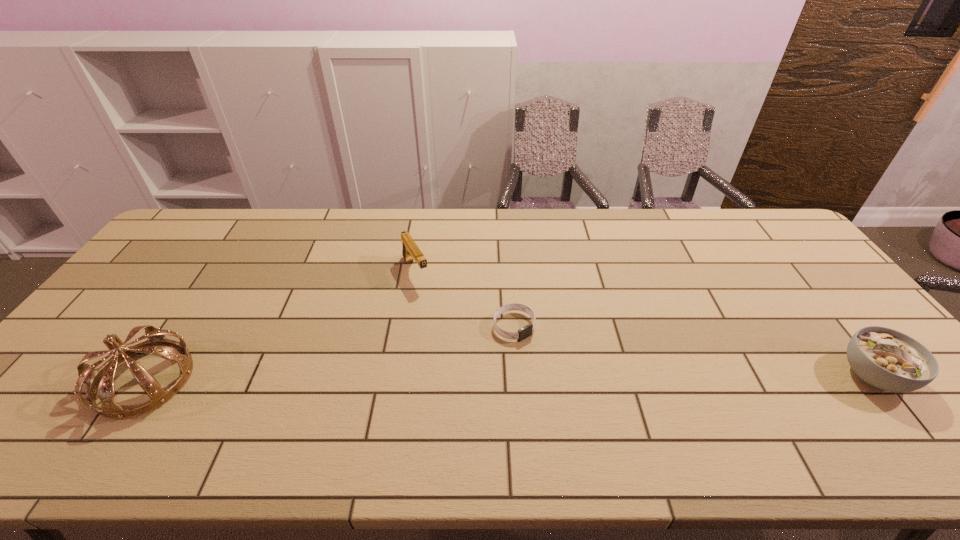
I want to click on empty location between the tallest object and the rightmost object, so click(509, 377).

The image size is (960, 540). What are the coordinates of `free space between the wristband and the rightmost object` in the screenshot? It's located at (694, 351).

Locate an element on the screen. This screenshot has width=960, height=540. free space between the wristband and the soup bowl is located at coordinates (694, 351).

Where is `vacant space that's between the third object from right to left and the soup bowl`? vacant space that's between the third object from right to left and the soup bowl is located at coordinates (644, 323).

I want to click on free space between the tallest object and the farthest object, so click(x=280, y=326).

Where is `free space between the rightmost object and the pistol`? free space between the rightmost object and the pistol is located at coordinates (644, 323).

I want to click on object that is the closest to the rightmost object, so click(x=526, y=331).

Identify which object is the second closest to the farthest object. Please provide its 2D coordinates. Your answer should be formatted as a tuple, i.e. [(x, y)], where the tuple contains the x and y coordinates of a point satisfying the conditions above.

[(101, 381)]

You are a GUI agent. You are given a task and a screenshot of the screen. Output one action in this format:
    pyautogui.click(x=<x>, y=<y>)
    Task: Click on the free space that satisfies the following two spatial constraints: 1. on the front side of the rightmost object; 2. on the left side of the second object from right to left
    The height and width of the screenshot is (540, 960).
    Given the screenshot: What is the action you would take?
    pyautogui.click(x=517, y=375)

The height and width of the screenshot is (540, 960). Identify the location of vacant space that satisfies the following two spatial constraints: 1. on the back side of the second farthest object; 2. on the left side of the tiara. (180, 326).